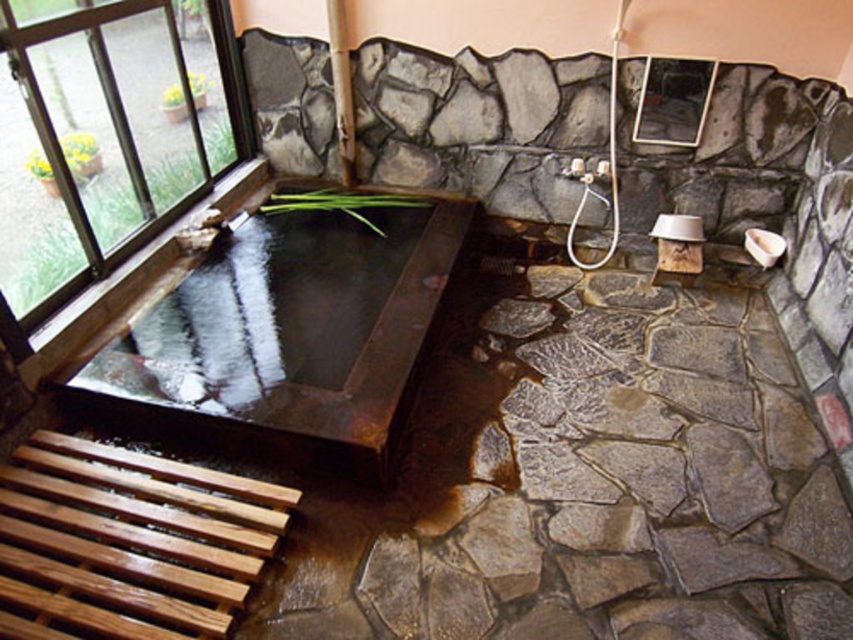
Question: Can you confirm if rusty metal tub at center is smaller than clear glass window at upper left?

Choices:
 (A) yes
 (B) no

Answer: (B)

Question: Which point is closer to the camera taking this photo?

Choices:
 (A) (62, 180)
 (B) (201, 317)

Answer: (A)

Question: Where is rusty metal tub at center located in relation to clear glass window at upper left in the image?

Choices:
 (A) left
 (B) right

Answer: (B)

Question: Which point appears farthest from the camera in this image?

Choices:
 (A) (144, 428)
 (B) (190, 166)

Answer: (B)

Question: Considering the relative positions of rusty metal tub at center and clear glass window at upper left in the image provided, where is rusty metal tub at center located with respect to clear glass window at upper left?

Choices:
 (A) right
 (B) left

Answer: (A)